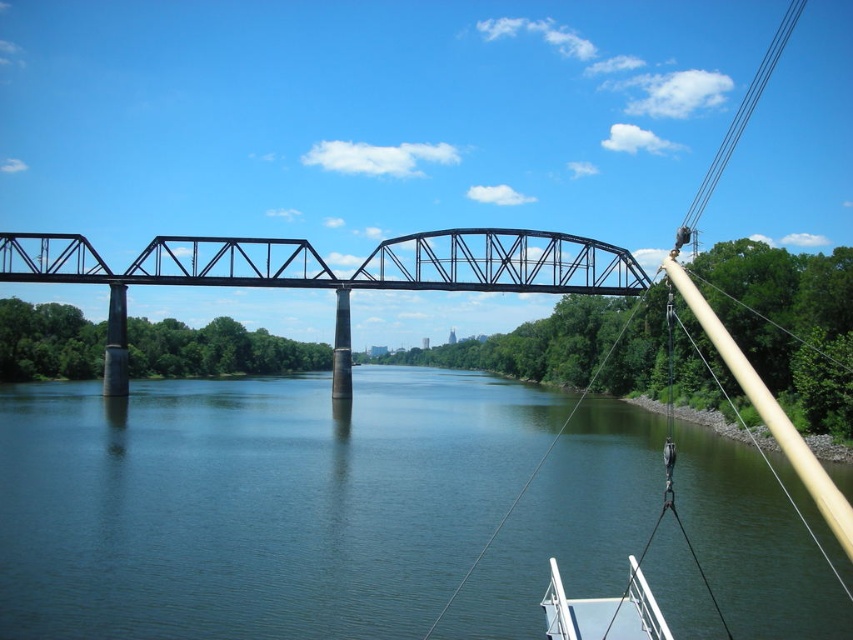
Question: Which point is farther to the camera?

Choices:
 (A) black metal train bridge at center
 (B) green smooth water at center
 (C) white glossy boat at lower right

Answer: (A)

Question: Which object is the closest to the green smooth water at center?

Choices:
 (A) white glossy boat at lower right
 (B) black metal train bridge at center

Answer: (A)

Question: Is black metal train bridge at center above white glossy boat at lower right?

Choices:
 (A) yes
 (B) no

Answer: (A)

Question: Is green smooth water at center bigger than white glossy boat at lower right?

Choices:
 (A) yes
 (B) no

Answer: (A)

Question: Considering the relative positions of green smooth water at center and black metal train bridge at center in the image provided, where is green smooth water at center located with respect to black metal train bridge at center?

Choices:
 (A) above
 (B) below

Answer: (B)

Question: Which object appears closest to the camera in this image?

Choices:
 (A) black metal train bridge at center
 (B) green smooth water at center
 (C) white glossy boat at lower right

Answer: (C)